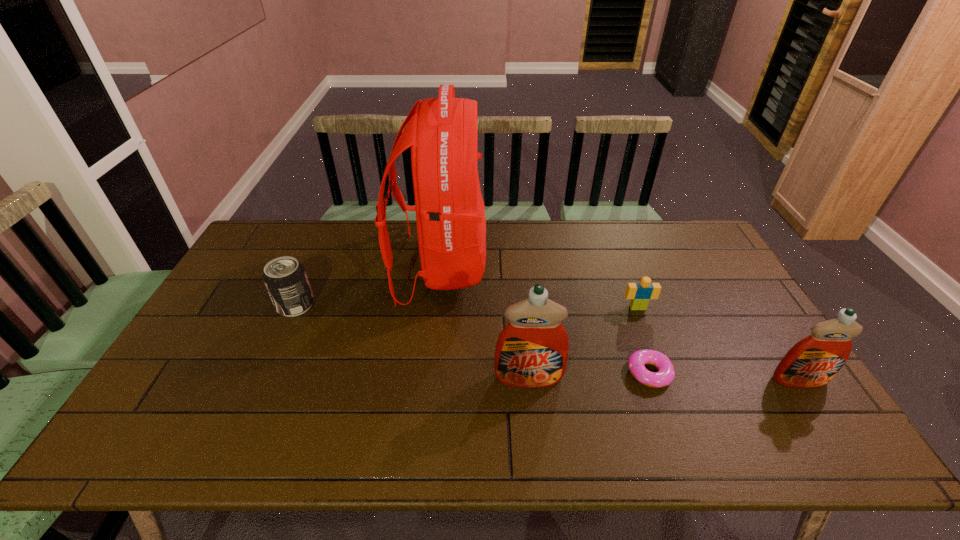
What are the coordinates of `vacant space at the near edge of the desktop` in the screenshot? It's located at (703, 404).

In the image, there is a desktop. At what (x,y) coordinates should I click in order to perform the action: click on vacant space at the left edge. Please return your answer as a coordinate pair (x, y). This screenshot has width=960, height=540. Looking at the image, I should click on (234, 320).

Where is `free space at the right edge`? Image resolution: width=960 pixels, height=540 pixels. free space at the right edge is located at coordinates (766, 335).

In the image, there is a desktop. Identify the location of vacant space at the far left corner. The image size is (960, 540). (278, 245).

What are the coordinates of `free spot between the tallest object and the third object from left to right` in the screenshot? It's located at (485, 322).

This screenshot has width=960, height=540. Find the location of `free spot between the fifth shortest object and the second object from left to right`. free spot between the fifth shortest object and the second object from left to right is located at coordinates (485, 322).

The image size is (960, 540). Identify the location of vacant region between the shortest object and the shorter detergent. (724, 376).

Find the location of a particular element. This screenshot has height=540, width=960. empty space between the third shortest object and the shortest object is located at coordinates (472, 339).

At what (x,y) coordinates should I click in order to perform the action: click on vacant area that lies between the doughnut and the right detergent. Please return your answer as a coordinate pair (x, y). The height and width of the screenshot is (540, 960). Looking at the image, I should click on (724, 376).

Where is `free space that is in between the Lego and the left detergent`? Image resolution: width=960 pixels, height=540 pixels. free space that is in between the Lego and the left detergent is located at coordinates (584, 343).